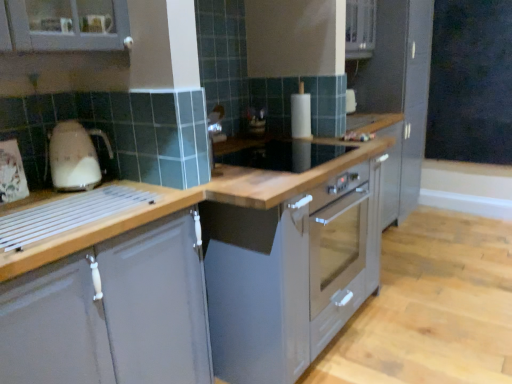
The image size is (512, 384). What are the coordinates of `free space in front of beige glossy kettle at left` in the screenshot? It's located at (45, 205).